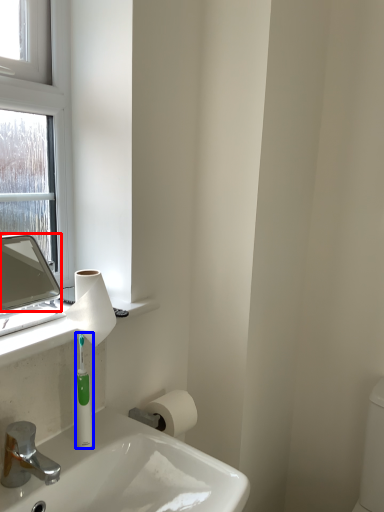
Question: Which object appears closest to the camera in this image, mirror (highlighted by a red box) or mouthwash (highlighted by a blue box)?

Choices:
 (A) mirror
 (B) mouthwash

Answer: (A)